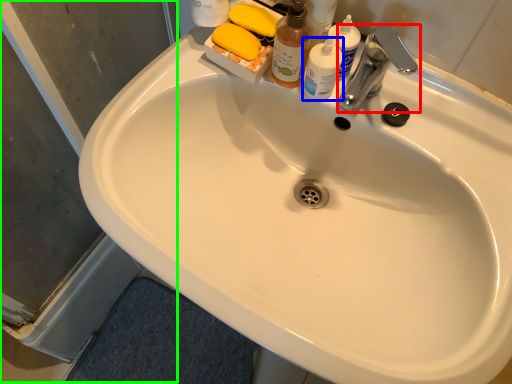
Question: Which is nearer to the tap (highlighted by a red box)? toiletry (highlighted by a blue box) or screen door (highlighted by a green box).

Choices:
 (A) toiletry
 (B) screen door

Answer: (A)